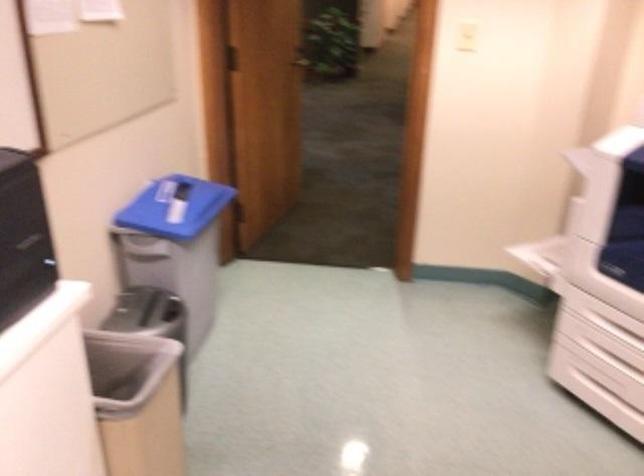
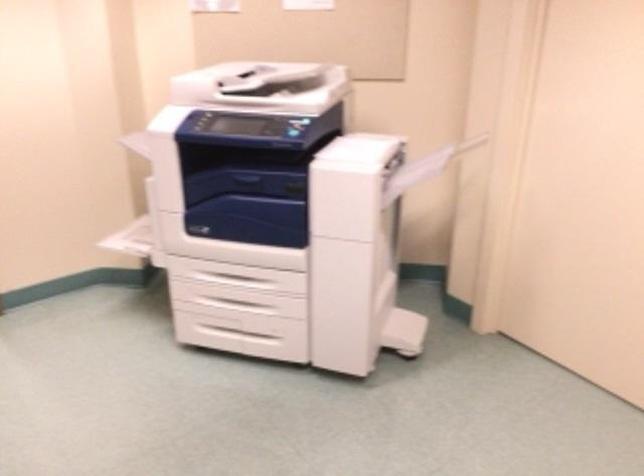
Question: The first image is from the beginning of the video and the second image is from the end. How did the camera likely rotate when shooting the video?

Choices:
 (A) Left
 (B) Right
 (C) Up
 (D) Down

Answer: (B)